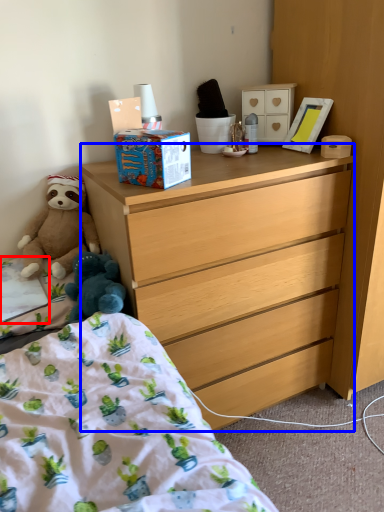
Question: Which point is closer to the camera, sheet (highlighted by a red box) or desk (highlighted by a blue box)?

Choices:
 (A) sheet
 (B) desk

Answer: (B)